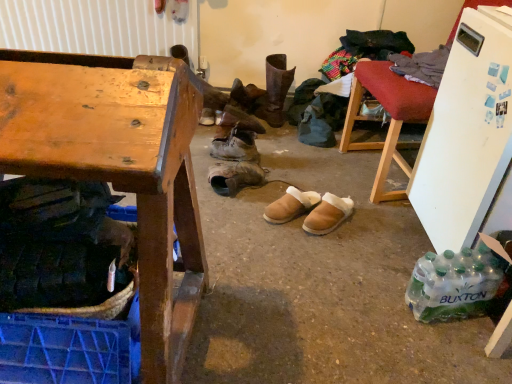
Question: Can you confirm if wooden chair at upper right is positioned to the right of leather boot at center, which ranks as the 1th footwear in top-to-bottom order?

Choices:
 (A) no
 (B) yes

Answer: (B)

Question: Is wooden chair at upper right shorter than leather boot at center, which is the fifth footwear from bottom to top?

Choices:
 (A) no
 (B) yes

Answer: (A)

Question: Is wooden chair at upper right not inside leather boot at center, which is the fifth footwear from bottom to top?

Choices:
 (A) yes
 (B) no

Answer: (A)

Question: From a real-world perspective, is wooden chair at upper right physically above leather boot at center, which is the fifth footwear from bottom to top?

Choices:
 (A) yes
 (B) no

Answer: (A)

Question: Could leather boot at center, which ranks as the 1th footwear in top-to-bottom order, be considered to be inside wooden chair at upper right?

Choices:
 (A) yes
 (B) no

Answer: (B)

Question: Is wooden chair at upper right thinner than leather boot at center, which ranks as the 1th footwear in top-to-bottom order?

Choices:
 (A) no
 (B) yes

Answer: (A)

Question: Is leather boot at center, which is the fifth footwear from bottom to top, taller than clear plastic bottles at lower right?

Choices:
 (A) no
 (B) yes

Answer: (B)

Question: Can you confirm if leather boot at center, which is the fifth footwear from bottom to top, is positioned to the left of clear plastic bottles at lower right?

Choices:
 (A) yes
 (B) no

Answer: (A)

Question: From the image's perspective, is leather boot at center, which ranks as the 1th footwear in top-to-bottom order, beneath clear plastic bottles at lower right?

Choices:
 (A) yes
 (B) no

Answer: (B)

Question: From a real-world perspective, is leather boot at center, which ranks as the 1th footwear in top-to-bottom order, beneath clear plastic bottles at lower right?

Choices:
 (A) yes
 (B) no

Answer: (B)

Question: Is leather boot at center, which is the fifth footwear from bottom to top, looking in the opposite direction of clear plastic bottles at lower right?

Choices:
 (A) yes
 (B) no

Answer: (B)

Question: Is leather boot at center, which is the fifth footwear from bottom to top, aimed at clear plastic bottles at lower right?

Choices:
 (A) yes
 (B) no

Answer: (A)

Question: Can you confirm if wooden desk at left is positioned to the left of wooden chair at upper right?

Choices:
 (A) yes
 (B) no

Answer: (A)